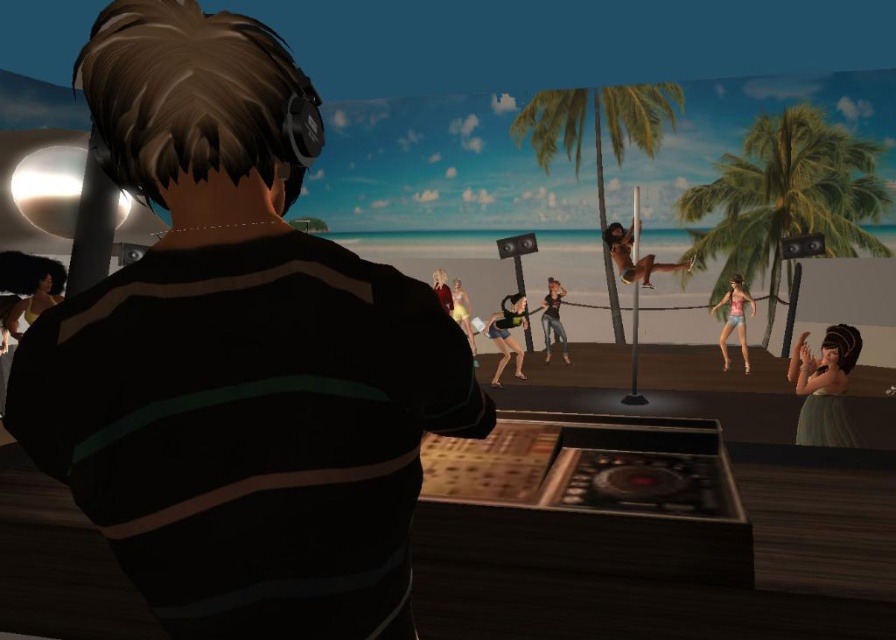
You are a lifeguard standing on the wooden platform near the DJ booth. You see the shiny black pole at center and the yellow matte swimsuit at center. Which object is taller?

The shiny black pole at center is taller than the yellow matte swimsuit at center.

You are a dancer preparing to perform at the beach DJ booth. You see the pink denim shorts at center and the shiny black pole at center. Which object is positioned lower from the ground?

The pink denim shorts at center is below the shiny black pole at center, so it is positioned lower from the ground.